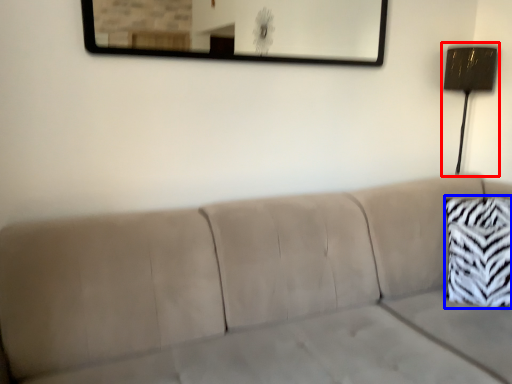
Question: Which of the following is the closest to the observer, lamp (highlighted by a red box) or throw pillow (highlighted by a blue box)?

Choices:
 (A) lamp
 (B) throw pillow

Answer: (B)